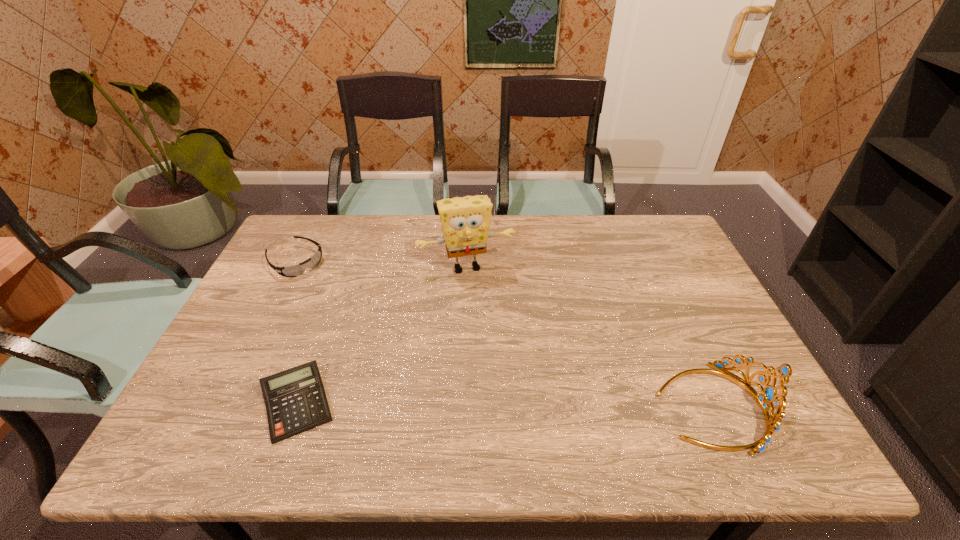
Find the location of `calculator`. calculator is located at coordinates (295, 399).

This screenshot has height=540, width=960. In order to click on the rightmost object in this screenshot , I will do `click(769, 395)`.

Locate an element on the screen. The image size is (960, 540). tiara is located at coordinates (769, 395).

Where is `sunglasses`? This screenshot has width=960, height=540. sunglasses is located at coordinates (297, 270).

You are a GUI agent. You are given a task and a screenshot of the screen. Output one action in this format:
    pyautogui.click(x=<x>, y=<y>)
    Task: Click on the second object from right to left
    
    Given the screenshot: What is the action you would take?
    pyautogui.click(x=465, y=221)

Locate an element on the screen. The image size is (960, 540). the tallest object is located at coordinates (465, 221).

At what (x,y) coordinates should I click in order to perform the action: click on vacant space situated 0.370m on the back of the calculator. Please return your answer as a coordinate pair (x, y). Image resolution: width=960 pixels, height=540 pixels. Looking at the image, I should click on (345, 271).

Where is `blank space located on the lenses of the sunglasses`? The height and width of the screenshot is (540, 960). blank space located on the lenses of the sunglasses is located at coordinates (337, 295).

At what (x,y) coordinates should I click in order to perform the action: click on vacant space located 0.070m on the lenses of the sunglasses. Please return your answer as a coordinate pair (x, y). Image resolution: width=960 pixels, height=540 pixels. Looking at the image, I should click on (324, 284).

Image resolution: width=960 pixels, height=540 pixels. What are the coordinates of `free region located on the lenses of the sunglasses` in the screenshot? It's located at (373, 325).